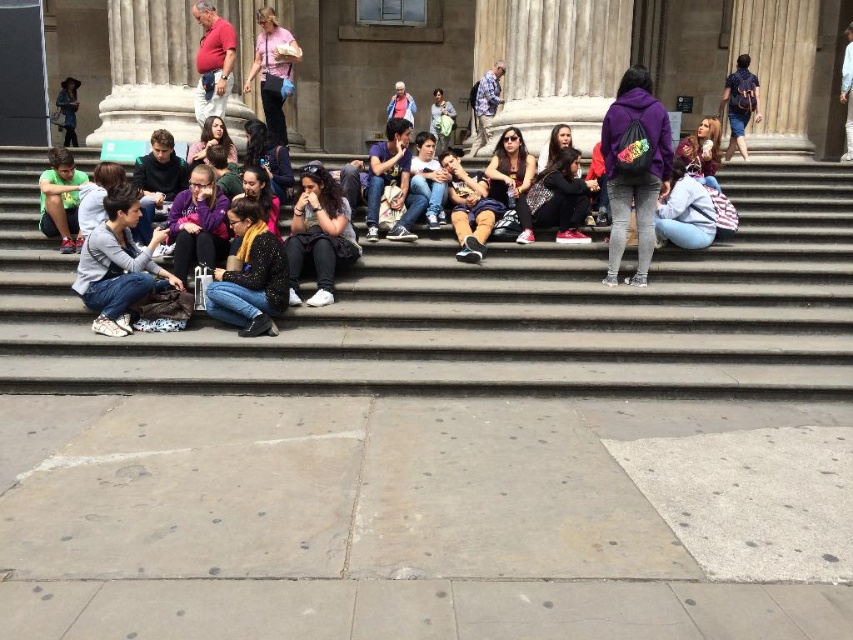
Question: Which of the following is the closest to the observer?

Choices:
 (A) (844, 80)
 (B) (271, 61)
 (C) (155, 236)

Answer: (C)

Question: From the image, what is the correct spatial relationship of purple fleece jacket at center in relation to light blue denim jacket at upper center?

Choices:
 (A) left
 (B) right

Answer: (A)

Question: Which of these objects is positioned closest to the dark blue shirt at upper right?

Choices:
 (A) matte purple hoodie at center
 (B) light blue denim jacket at upper center
 (C) denim jacket at left

Answer: (B)

Question: Which point is closer to the camera?

Choices:
 (A) (99, 276)
 (B) (335, 250)
 (C) (479, 244)

Answer: (A)

Question: Can you confirm if matte red shirt at upper center is positioned to the right of denim jacket at left?

Choices:
 (A) yes
 (B) no

Answer: (A)

Question: Does dark blue shirt at upper right appear on the right side of patterned shirt at center?

Choices:
 (A) no
 (B) yes

Answer: (B)